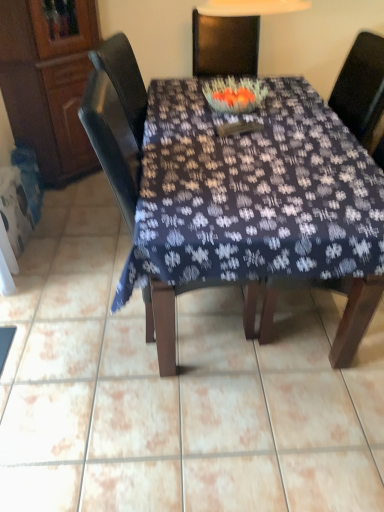
Question: Relative to wooden chair at center, which is counted as the 1th chair, starting from the right, is dark fabric table at center in front or behind?

Choices:
 (A) behind
 (B) front

Answer: (B)

Question: Would you say dark fabric table at center is to the left or to the right of wooden chair at center, which is counted as the 1th chair, starting from the right, in the picture?

Choices:
 (A) right
 (B) left

Answer: (B)

Question: Which of these objects is positioned closest to the dark fabric table at center?

Choices:
 (A) wooden cabinet at left
 (B) matte dark wood chair at center, the first chair from the left
 (C) wooden chair at center, which is counted as the 1th chair, starting from the right

Answer: (B)

Question: Which is farther from the wooden chair at center, marked as the 2th chair in a left-to-right arrangement?

Choices:
 (A) dark fabric table at center
 (B) matte dark wood chair at center, the first chair from the left
 (C) wooden cabinet at left

Answer: (C)